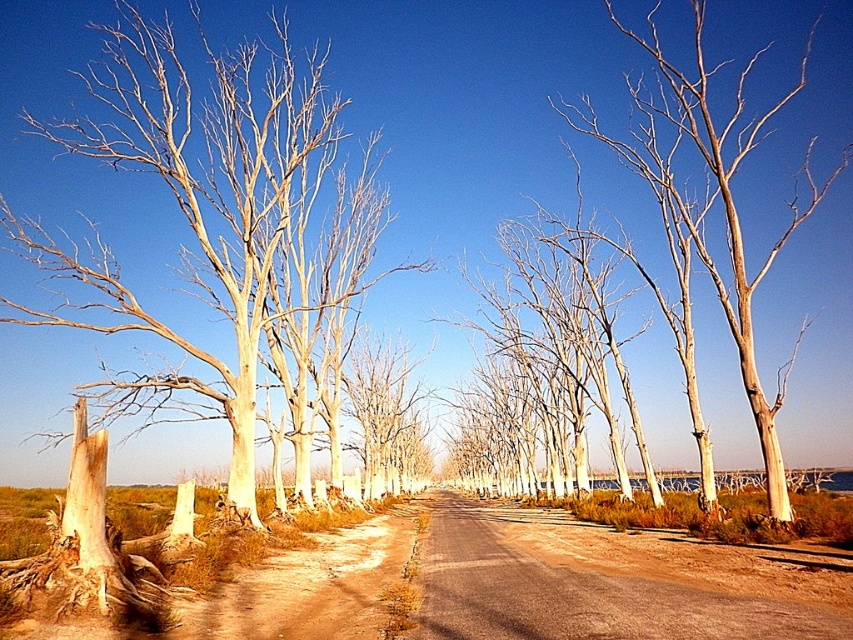
Looking at this image, you are standing at the point marked by the coordinates point (193, 204) in the image. Looking around, you see a light brown bark tree at left. Which direction should you walk to reach the road?

The point (193, 204) corresponds to the light brown bark tree at left, so you should walk towards the right to reach the road.

You are a hiker trying to walk along the brown dirt track at center while avoiding stepping on the smooth bark tree at center. Which path is narrower and requires more careful navigation?

The brown dirt track at center is thinner than the smooth bark tree at center, so the hiker should navigate carefully along the narrower brown dirt track at center to avoid stepping on the tree.

You are a photographer planning to capture the entire view of the light brown bark tree at left and the smooth bark tree at center in a single frame. Based on their sizes in the image, which tree should you focus on to ensure both fit without cropping?

The light brown bark tree at left occupies less space than the smooth bark tree at center, so focusing on the smooth bark tree at center will help ensure both trees fit in the frame since it takes up more space and can serve as the main subject while the smaller one remains visible.